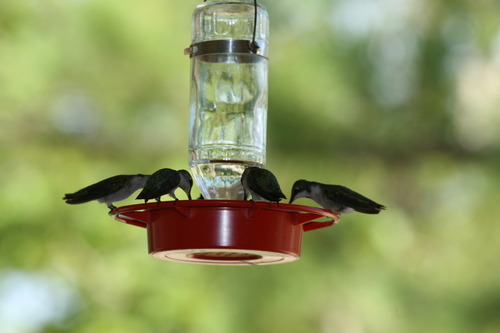
The height and width of the screenshot is (333, 500). I want to click on black bracket with wire hanger, so click(253, 44), click(220, 51), click(256, 25).